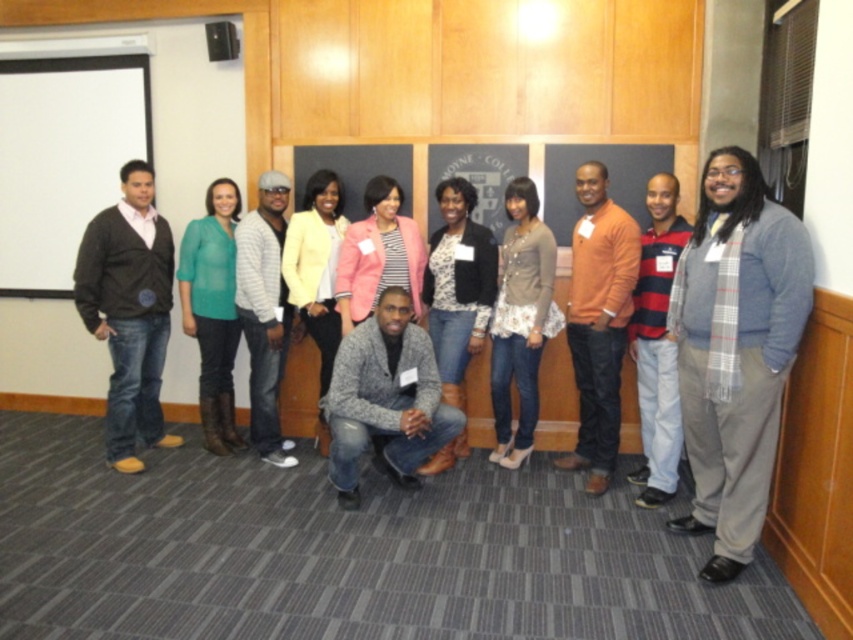
You are organizing a group photo and need to ensure proper positioning. Given the current arrangement, which of the two central clothing items, the matte gray cardigan at center or the pink fabric jacket at center, is positioned to the right of the other?

The matte gray cardigan at center is to the right of the pink fabric jacket at center.

You are organizing a team photo and need to ensure that the gray woolen sweater at center and the pink fabric jacket at center are positioned correctly according to the scene. Which item is positioned to the right of the other?

The gray woolen sweater at center is positioned to the right of the pink fabric jacket at center.